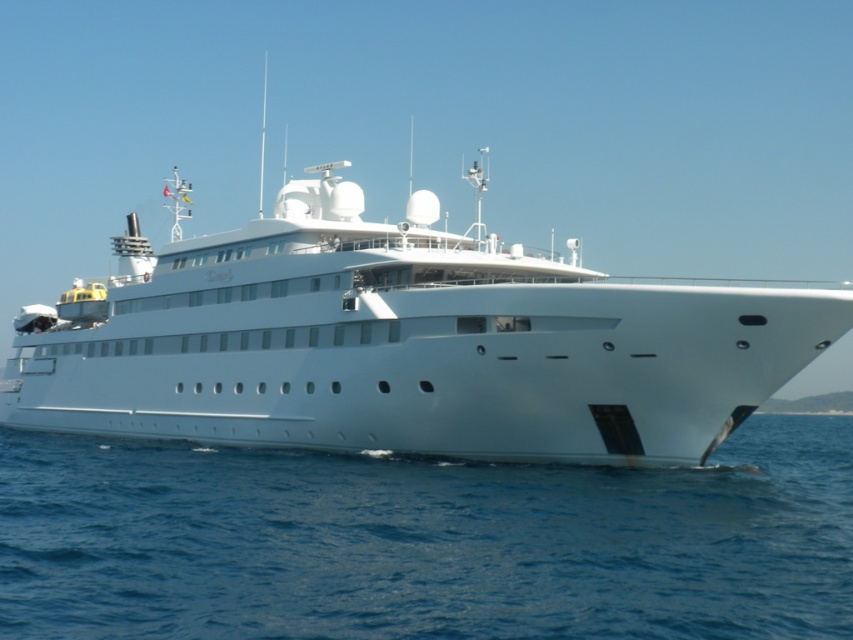
From the picture: You are a passenger on the white glossy yacht at center and want to jump into the blue water at lower right. Is the yacht positioned over the water where you want to jump?

Yes, the white glossy yacht at center is positioned over the blue water at lower right, so jumping from there would land you in the desired location.